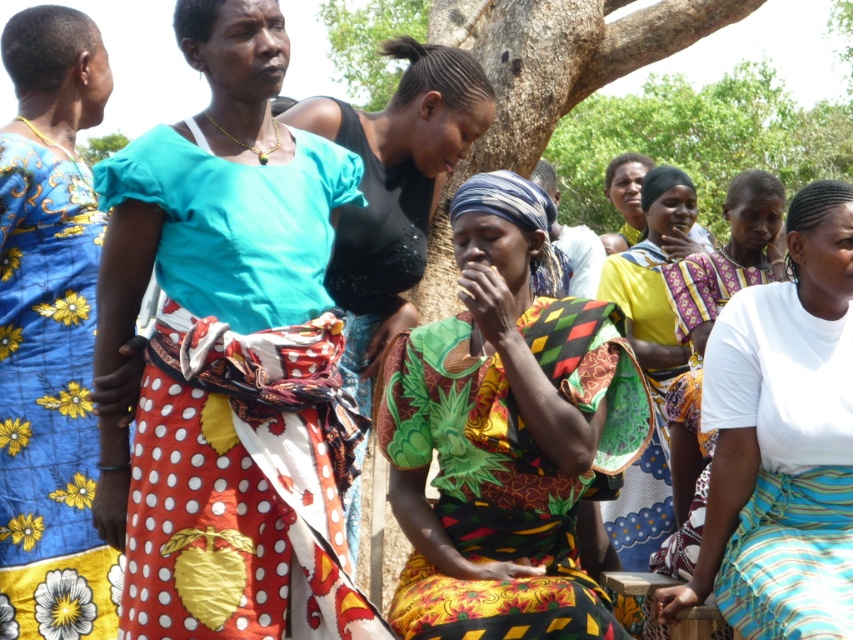
Does white cotton shirt at center have a larger size compared to black sequined dress at center?

Yes, white cotton shirt at center is bigger than black sequined dress at center.

Does white cotton shirt at center appear over black sequined dress at center?

No.

The image size is (853, 640). Describe the element at coordinates (782, 440) in the screenshot. I see `white cotton shirt at center` at that location.

At what (x,y) coordinates should I click in order to perform the action: click on white cotton shirt at center. Please return your answer as a coordinate pair (x, y). The image size is (853, 640). Looking at the image, I should click on (782, 440).

Identify the location of matte black top at center. (393, 189).

Between matte black top at center and brown rough tree trunk at center, which one has more height?

brown rough tree trunk at center

Who is more forward, (x=438, y=157) or (x=642, y=45)?

Point (x=438, y=157) is in front.

This screenshot has height=640, width=853. Identify the location of matte black top at center. (393, 189).

Is the position of blue floral fabric dress at left less distant than that of brown rough tree trunk at center?

That is True.

Looking at this image, is blue floral fabric dress at left taller than brown rough tree trunk at center?

Incorrect, blue floral fabric dress at left's height is not larger of brown rough tree trunk at center's.

What do you see at coordinates (49, 401) in the screenshot? I see `blue floral fabric dress at left` at bounding box center [49, 401].

Where is `blue floral fabric dress at left`? blue floral fabric dress at left is located at coordinates (49, 401).